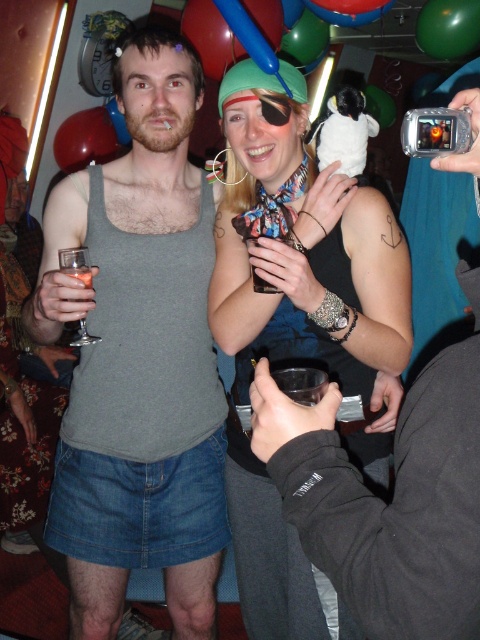
Question: Can you confirm if green rubber balloon at upper right is positioned above clear glass wine glass at left?

Choices:
 (A) yes
 (B) no

Answer: (A)

Question: Does green rubber balloon at upper right have a lesser width compared to clear plastic cup at left?

Choices:
 (A) yes
 (B) no

Answer: (B)

Question: Among these points, which one is farthest from the camera?

Choices:
 (A) (85, 276)
 (B) (87, 138)
 (C) (236, 232)

Answer: (B)

Question: In this image, where is green rubber balloon at upper right located relative to clear glass wine glass at left?

Choices:
 (A) left
 (B) right

Answer: (B)

Question: Among these objects, which one is nearest to the camera?

Choices:
 (A) clear glass wine glass at left
 (B) translucent plastic cup at center
 (C) green rubber balloon at upper right
 (D) gray matte tank top at center

Answer: (B)

Question: Which point is farther to the camera?

Choices:
 (A) (68, 154)
 (B) (435, 1)

Answer: (A)